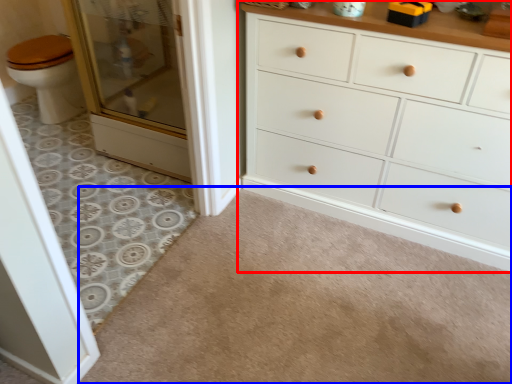
Question: Which point is further to the camera, chest of drawers (highlighted by a red box) or plain (highlighted by a blue box)?

Choices:
 (A) chest of drawers
 (B) plain

Answer: (A)